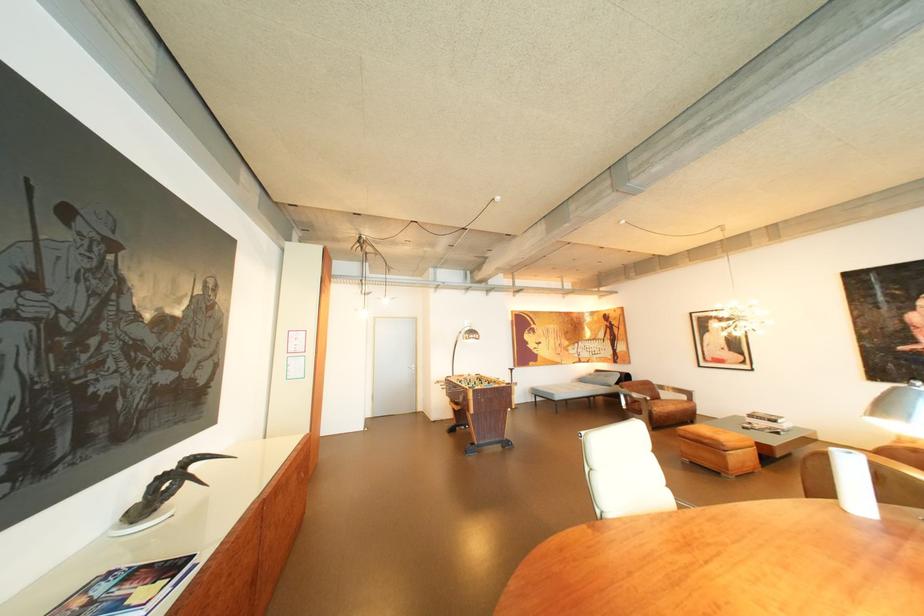
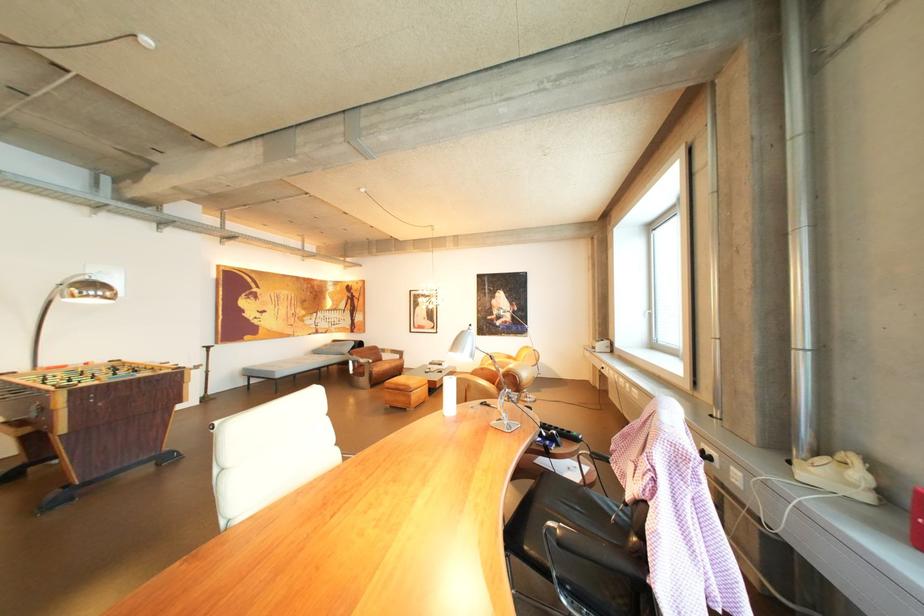
In the second image, find the point that corresponds to point (737, 459) in the first image.

(422, 398)